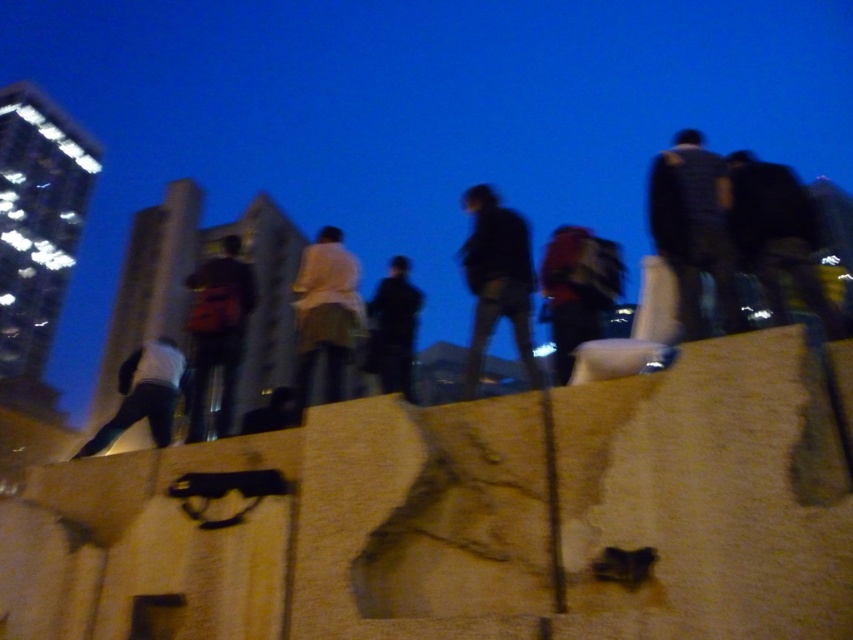
Can you confirm if dark gray backpack at upper right is positioned below dark blue fabric jacket at center?

Incorrect, dark gray backpack at upper right is not positioned below dark blue fabric jacket at center.

Is dark gray backpack at upper right above dark blue fabric jacket at center?

Correct, dark gray backpack at upper right is located above dark blue fabric jacket at center.

Describe the element at coordinates (775, 232) in the screenshot. This screenshot has width=853, height=640. I see `dark gray backpack at upper right` at that location.

The image size is (853, 640). I want to click on dark gray backpack at upper right, so click(775, 232).

Does dark blue textured jacket at upper right lie in front of dark gray pants at left?

That is True.

I want to click on dark blue textured jacket at upper right, so click(693, 230).

Consider the image. Which of these two, dark gray backpack at upper right or matte black backpack at center, stands taller?

With more height is matte black backpack at center.

What do you see at coordinates (775, 232) in the screenshot? I see `dark gray backpack at upper right` at bounding box center [775, 232].

Identify the location of dark gray backpack at upper right. The width and height of the screenshot is (853, 640). [x=775, y=232].